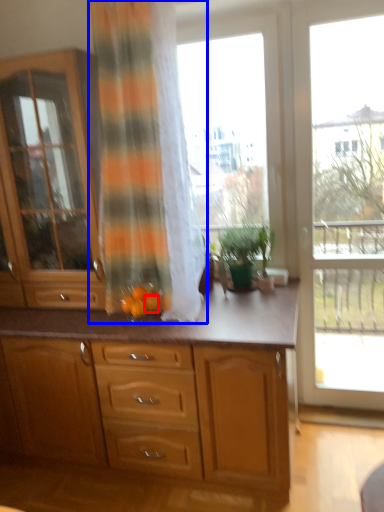
Question: Which object appears farthest to the camera in this image, tangerine (highlighted by a red box) or curtain (highlighted by a blue box)?

Choices:
 (A) tangerine
 (B) curtain

Answer: (A)